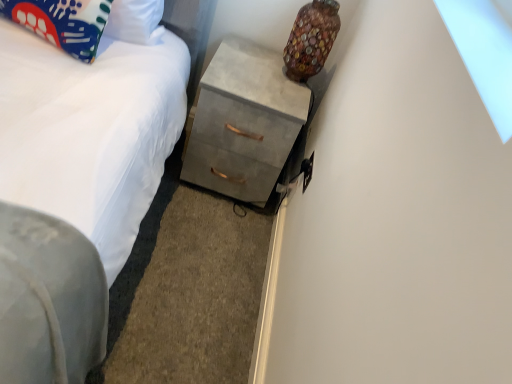
Question: Is white fabric bed at lower left smaller than concrete gray chest of drawers at center?

Choices:
 (A) yes
 (B) no

Answer: (A)

Question: Is white fabric bed at lower left further to camera compared to concrete gray chest of drawers at center?

Choices:
 (A) yes
 (B) no

Answer: (B)

Question: Is white fabric bed at lower left to the right of concrete gray chest of drawers at center from the viewer's perspective?

Choices:
 (A) yes
 (B) no

Answer: (B)

Question: Does white fabric bed at lower left have a greater width compared to concrete gray chest of drawers at center?

Choices:
 (A) no
 (B) yes

Answer: (B)

Question: Is there a large distance between white fabric bed at lower left and concrete gray chest of drawers at center?

Choices:
 (A) yes
 (B) no

Answer: (B)

Question: Is white fabric bed at lower left closer to camera compared to concrete gray chest of drawers at center?

Choices:
 (A) no
 (B) yes

Answer: (B)

Question: Considering the relative sizes of concrete gray chest of drawers at center and matte fabric pillow at upper left in the image provided, is concrete gray chest of drawers at center bigger than matte fabric pillow at upper left?

Choices:
 (A) no
 (B) yes

Answer: (B)

Question: Considering the relative positions of concrete gray chest of drawers at center and matte fabric pillow at upper left in the image provided, is concrete gray chest of drawers at center behind matte fabric pillow at upper left?

Choices:
 (A) no
 (B) yes

Answer: (B)

Question: Is concrete gray chest of drawers at center located outside matte fabric pillow at upper left?

Choices:
 (A) no
 (B) yes

Answer: (B)

Question: Does concrete gray chest of drawers at center have a smaller size compared to matte fabric pillow at upper left?

Choices:
 (A) yes
 (B) no

Answer: (B)

Question: Is concrete gray chest of drawers at center placed right next to matte fabric pillow at upper left?

Choices:
 (A) no
 (B) yes

Answer: (A)

Question: From a real-world perspective, is concrete gray chest of drawers at center located beneath matte fabric pillow at upper left?

Choices:
 (A) yes
 (B) no

Answer: (A)

Question: Is matte fabric pillow at upper left at the back of multicolored glass vase at upper right?

Choices:
 (A) no
 (B) yes

Answer: (A)